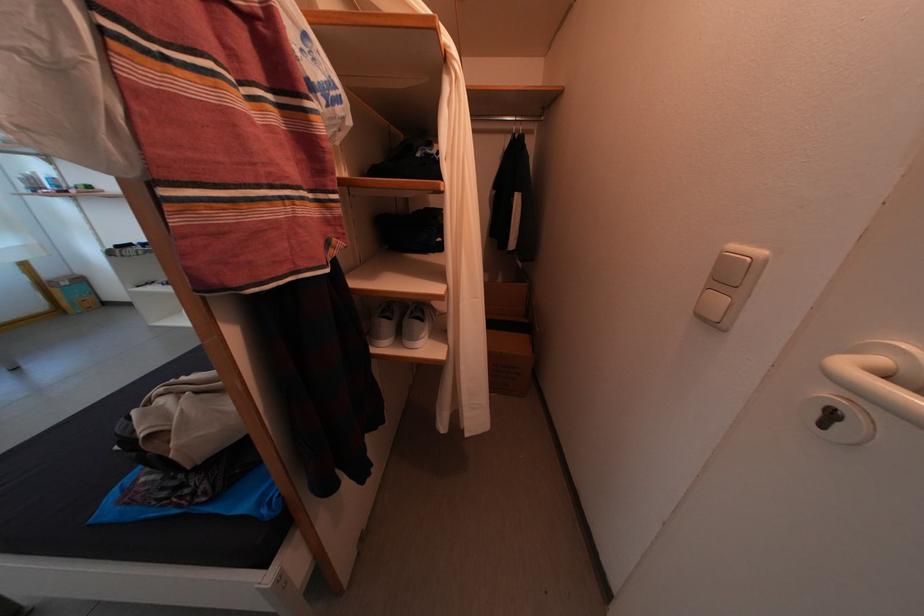
Where would you pull the white door handle? Please return your answer as a coordinate pair (x, y).

(881, 377)